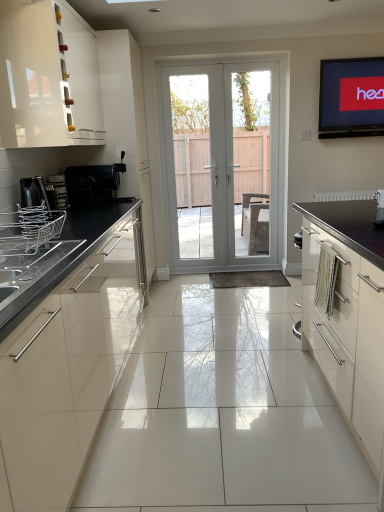
Locate an element on the screen. This screenshot has width=384, height=512. free location above matte black tv at upper right (from a real-world perspective) is located at coordinates (360, 54).